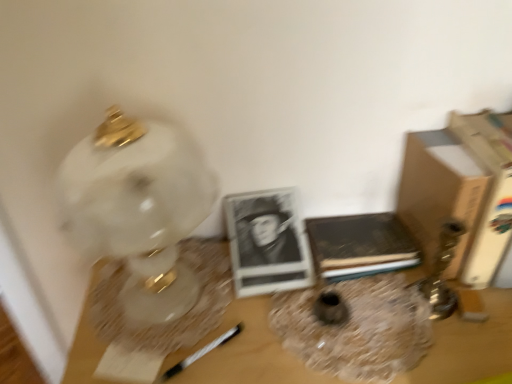
Locate an element on the screen. This screenshot has height=384, width=512. free location above wooden table at center (from a real-world perspective) is located at coordinates (300, 309).